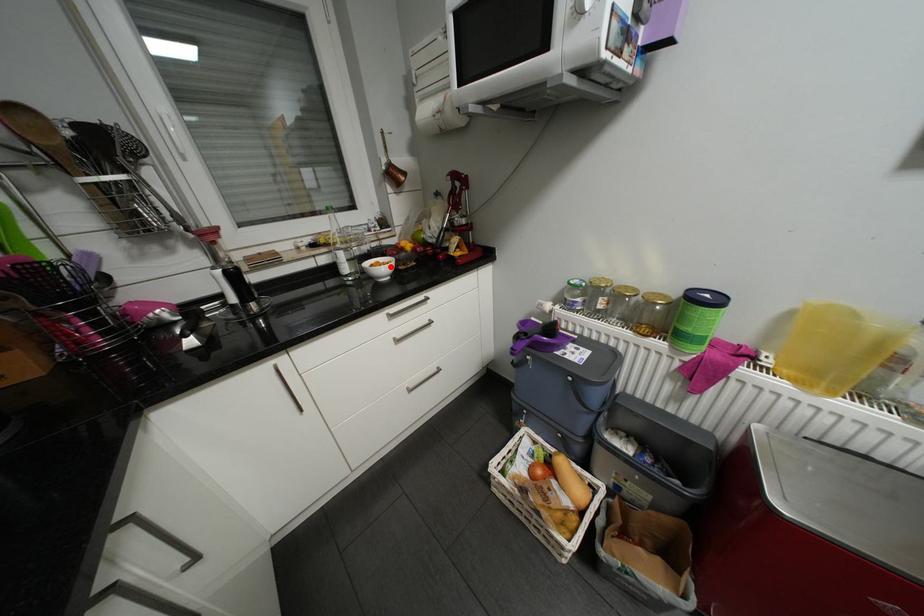
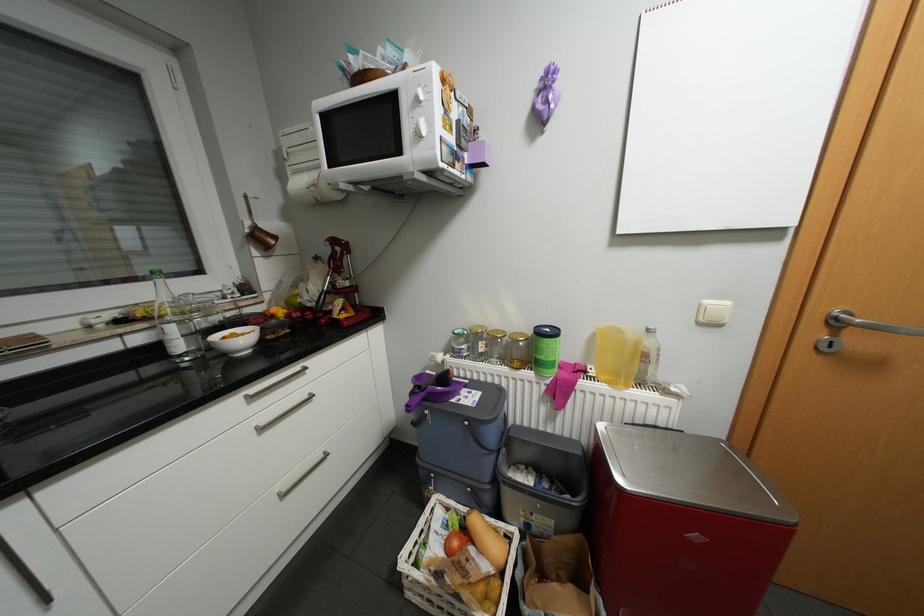
The point at the highlighted location is marked in the first image. Where is the corresponding point in the second image?

(249, 339)